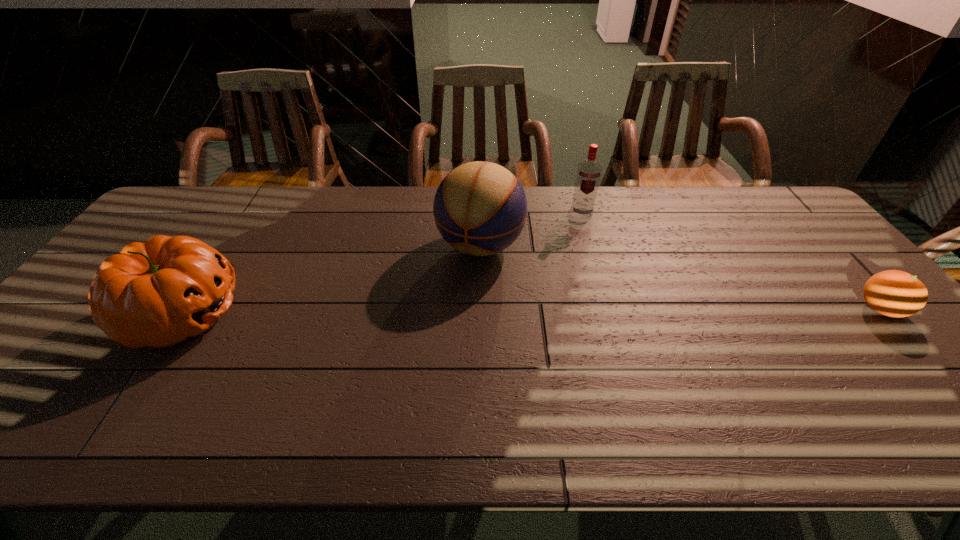
Find the location of a particular element. free space between the basketball and the pumpkin is located at coordinates (331, 280).

Where is `vacant area that lies between the vodka and the leftmost object`? The width and height of the screenshot is (960, 540). vacant area that lies between the vodka and the leftmost object is located at coordinates (382, 264).

The height and width of the screenshot is (540, 960). I want to click on the third closest object relative to the rightmost object, so click(x=158, y=293).

Select which object is the closest to the second object from left to right. Please provide its 2D coordinates. Your answer should be formatted as a tuple, i.e. [(x, y)], where the tuple contains the x and y coordinates of a point satisfying the conditions above.

[(588, 175)]

Identify the location of vacant position in the image that satisfies the following two spatial constraints: 1. on the front side of the shortest object; 2. on the left side of the vodka. (610, 309).

Where is `free space that satisfies the following two spatial constraints: 1. on the front side of the third object from right to left; 2. on the left side of the shortest object`? The height and width of the screenshot is (540, 960). free space that satisfies the following two spatial constraints: 1. on the front side of the third object from right to left; 2. on the left side of the shortest object is located at coordinates (480, 309).

Locate an element on the screen. The width and height of the screenshot is (960, 540). vacant space that satisfies the following two spatial constraints: 1. on the front side of the orange; 2. on the left side of the second object from right to left is located at coordinates coord(610,309).